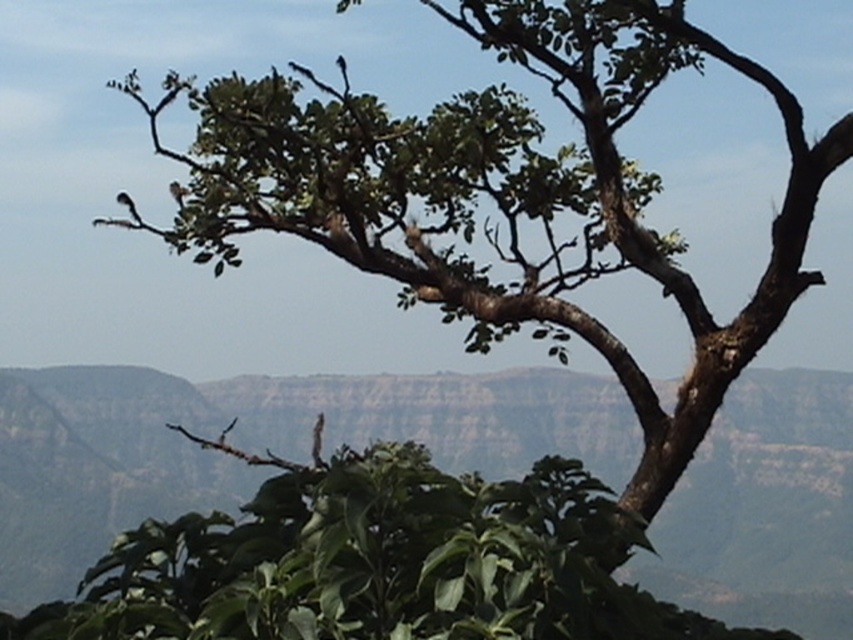
Based on the photo, is green leafy tree at center shorter than white feathered bird at upper left?

In fact, green leafy tree at center may be taller than white feathered bird at upper left.

Who is positioned more to the right, green leafy tree at center or white feathered bird at upper left?

green leafy tree at center is more to the right.

Who is more distant from viewer, (775, 568) or (172, 188)?

Positioned behind is point (775, 568).

Where is `green leafy tree at center`? green leafy tree at center is located at coordinates (254, 444).

Does point (131, 208) come farther from viewer compared to point (180, 205)?

That is False.

Between silvery metallic bird at upper left and white feathered bird at upper left, which one is positioned higher?

white feathered bird at upper left

Which is in front, point (136, 218) or point (183, 202)?

Point (136, 218)

Where is `silvery metallic bird at upper left`? This screenshot has width=853, height=640. silvery metallic bird at upper left is located at coordinates (129, 208).

Between point (665, 381) and point (125, 204), which one is positioned behind?

Positioned behind is point (665, 381).

The height and width of the screenshot is (640, 853). I want to click on green leafy tree at center, so click(x=254, y=444).

What do you see at coordinates (254, 444) in the screenshot?
I see `green leafy tree at center` at bounding box center [254, 444].

What are the coordinates of `green leafy tree at center` in the screenshot? It's located at (254, 444).